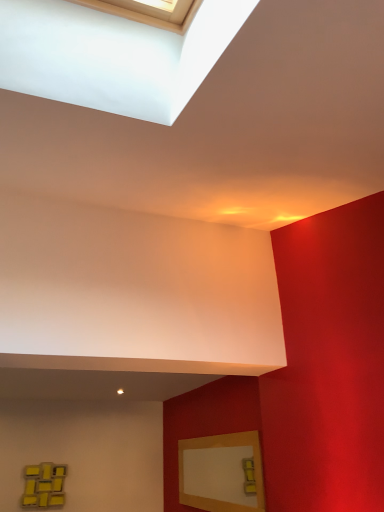
Question: From the image's perspective, is matte wood picture frame at lower right, the 2th picture frame from the back, located above or below yellow matte picture frame at lower left, arranged as the 1th picture frame when viewed from the back?

Choices:
 (A) below
 (B) above

Answer: (B)

Question: Is matte wood picture frame at lower right, which is the first picture frame from right to left, spatially inside yellow matte picture frame at lower left, the first picture frame viewed from the left, or outside of it?

Choices:
 (A) inside
 (B) outside

Answer: (B)

Question: Is matte wood picture frame at lower right, the 2th picture frame from the back, bigger or smaller than yellow matte picture frame at lower left, the 2th picture frame from the right?

Choices:
 (A) big
 (B) small

Answer: (A)

Question: Choose the correct answer: Is yellow matte picture frame at lower left, the 2th picture frame in the front-to-back sequence, inside matte wood picture frame at lower right, the first picture frame viewed from the front, or outside it?

Choices:
 (A) outside
 (B) inside

Answer: (A)

Question: Would you say yellow matte picture frame at lower left, the first picture frame viewed from the left, is to the left or to the right of matte wood picture frame at lower right, the 2th picture frame from the back, in the picture?

Choices:
 (A) right
 (B) left

Answer: (B)

Question: From the image's perspective, is yellow matte picture frame at lower left, the 2th picture frame in the front-to-back sequence, positioned above or below matte wood picture frame at lower right, the 2th picture frame from the back?

Choices:
 (A) above
 (B) below

Answer: (B)

Question: Is point (26, 467) positioned closer to the camera than point (193, 443)?

Choices:
 (A) farther
 (B) closer

Answer: (A)